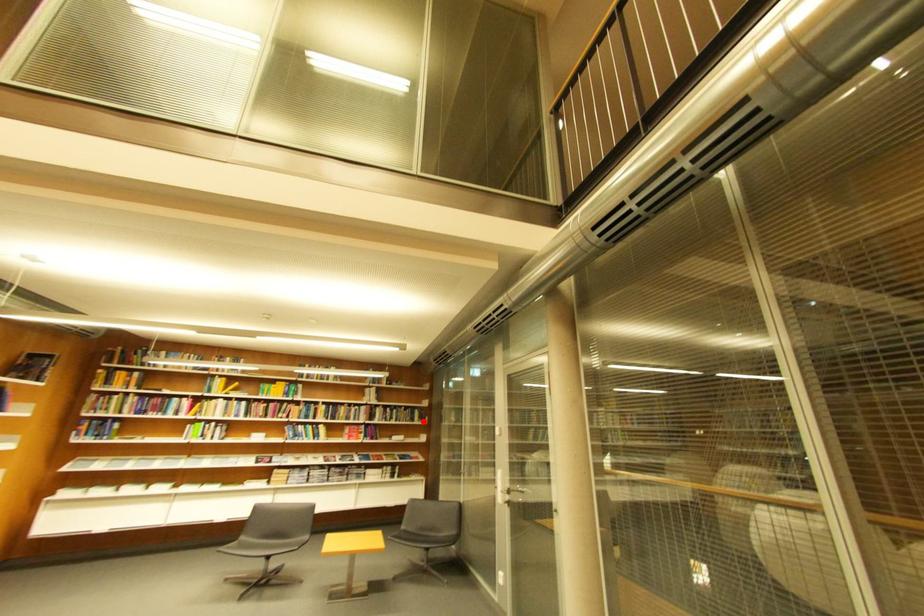
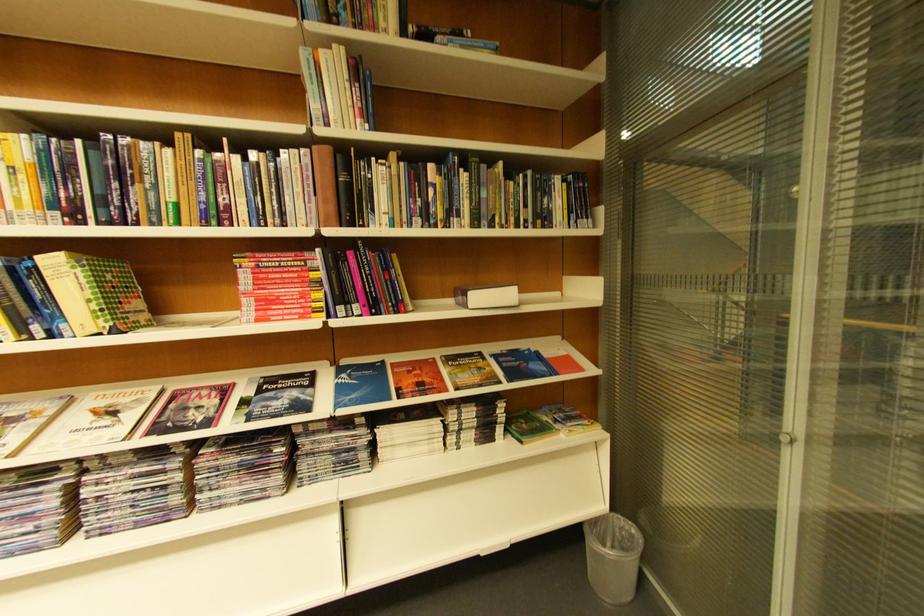
Question: I am providing you with two images of the same scene from different viewpoints. In image1, a red point is highlighted. Considering the same 3D point in image2, which of the following is correct?

Choices:
 (A) It is closer
 (B) It is farther

Answer: (A)